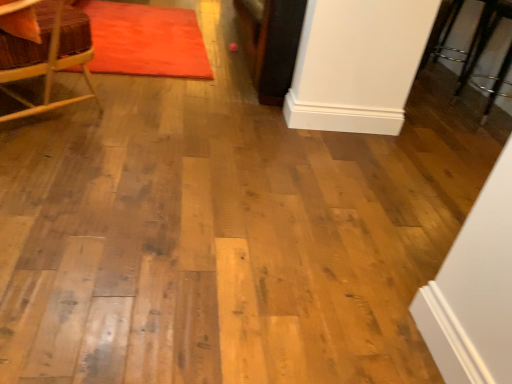
Question: Considering the relative sizes of velvet orange mat at upper left and wooden chair at left in the image provided, is velvet orange mat at upper left wider than wooden chair at left?

Choices:
 (A) yes
 (B) no

Answer: (A)

Question: Can you confirm if velvet orange mat at upper left is smaller than wooden chair at left?

Choices:
 (A) yes
 (B) no

Answer: (A)

Question: Can you confirm if velvet orange mat at upper left is positioned to the right of wooden chair at left?

Choices:
 (A) no
 (B) yes

Answer: (B)

Question: Considering the relative sizes of velvet orange mat at upper left and wooden chair at left in the image provided, is velvet orange mat at upper left taller than wooden chair at left?

Choices:
 (A) no
 (B) yes

Answer: (A)

Question: Can wooden chair at left be found inside velvet orange mat at upper left?

Choices:
 (A) no
 (B) yes

Answer: (A)

Question: Is velvet orange mat at upper left looking in the opposite direction of wooden chair at left?

Choices:
 (A) no
 (B) yes

Answer: (A)

Question: Considering the relative sizes of wooden chair at left and velvet orange mat at upper left in the image provided, is wooden chair at left wider than velvet orange mat at upper left?

Choices:
 (A) no
 (B) yes

Answer: (A)

Question: Is wooden chair at left turned away from velvet orange mat at upper left?

Choices:
 (A) no
 (B) yes

Answer: (A)

Question: Does wooden chair at left have a larger size compared to velvet orange mat at upper left?

Choices:
 (A) no
 (B) yes

Answer: (B)

Question: Is wooden chair at left oriented towards velvet orange mat at upper left?

Choices:
 (A) no
 (B) yes

Answer: (B)

Question: Does wooden chair at left appear on the left side of velvet orange mat at upper left?

Choices:
 (A) yes
 (B) no

Answer: (A)

Question: Is wooden chair at left thinner than velvet orange mat at upper left?

Choices:
 (A) no
 (B) yes

Answer: (B)

Question: In the image, is wooden chair at left positioned in front of or behind velvet orange mat at upper left?

Choices:
 (A) behind
 (B) front

Answer: (B)